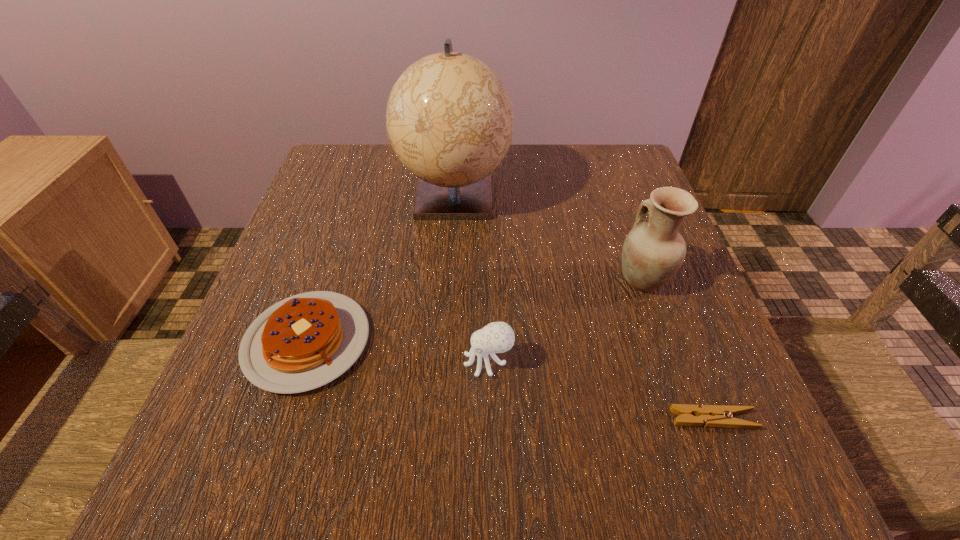
You are a GUI agent. You are given a task and a screenshot of the screen. Output one action in this format:
    pyautogui.click(x=<x>, y=<y>)
    Task: Click on the unoccupied area between the clothespin and the second shortest object
    The image size is (960, 540).
    Given the screenshot: What is the action you would take?
    pyautogui.click(x=510, y=380)

You are a GUI agent. You are given a task and a screenshot of the screen. Output one action in this format:
    pyautogui.click(x=<x>, y=<y>)
    Task: Click on the free spot between the nearest object and the octopus
    The width and height of the screenshot is (960, 540).
    Given the screenshot: What is the action you would take?
    pyautogui.click(x=601, y=390)

In order to click on free space between the fourth tallest object and the fourth shortest object in this screenshot , I will do `click(475, 310)`.

Locate an element on the screen. free space between the tallest object and the pottery is located at coordinates (548, 237).

Where is `the fourth closest object to the pancake`? This screenshot has width=960, height=540. the fourth closest object to the pancake is located at coordinates (720, 416).

Select which object is the third closest to the third tallest object. Please provide its 2D coordinates. Your answer should be formatted as a tuple, i.e. [(x, y)], where the tuple contains the x and y coordinates of a point satisfying the conditions above.

[(720, 416)]

Find the location of a particular element. This screenshot has width=960, height=540. vacant space that satisfies the following two spatial constraints: 1. on the front-facing side of the third shortest object; 2. on the right side of the nearest object is located at coordinates (490, 420).

At what (x,y) coordinates should I click in order to perform the action: click on free location that satisfies the following two spatial constraints: 1. on the back side of the second shortest object; 2. on the left side of the second tallest object. Please return your answer as a coordinate pair (x, y). The width and height of the screenshot is (960, 540). Looking at the image, I should click on (327, 280).

Locate an element on the screen. free location that satisfies the following two spatial constraints: 1. on the back side of the pottery; 2. on the left side of the second shortest object is located at coordinates (327, 280).